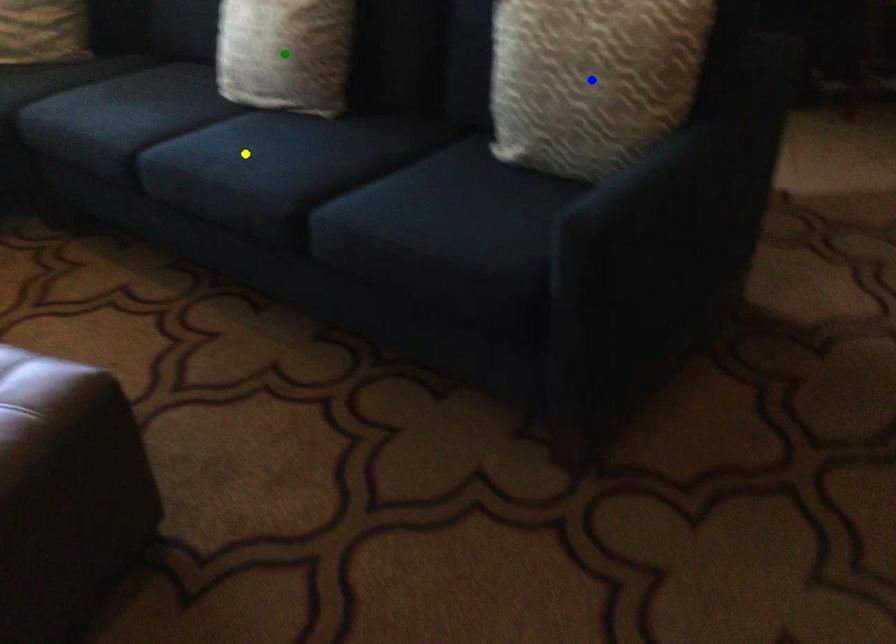
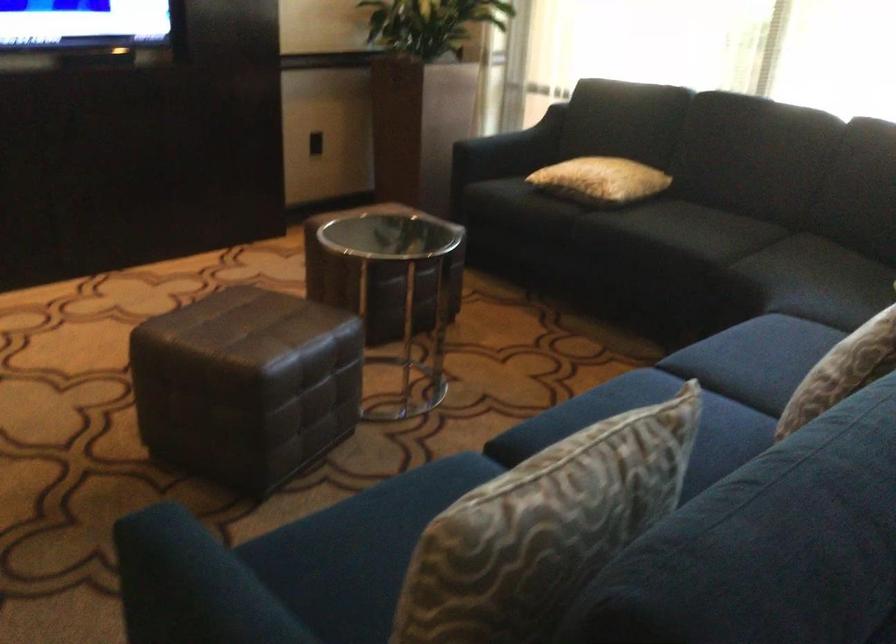
I am providing you with two images of the same scene from different viewpoints. Three points are marked in image1. Which point corresponds to a part or object that is occluded in image2?In image1, three points are marked. Which of them correspond to a part or object that is occluded in image2?Among the three points shown in image1, which one corresponds to a part or object that is no longer visible due to occlusion in image2?

blue point, green point, yellow point